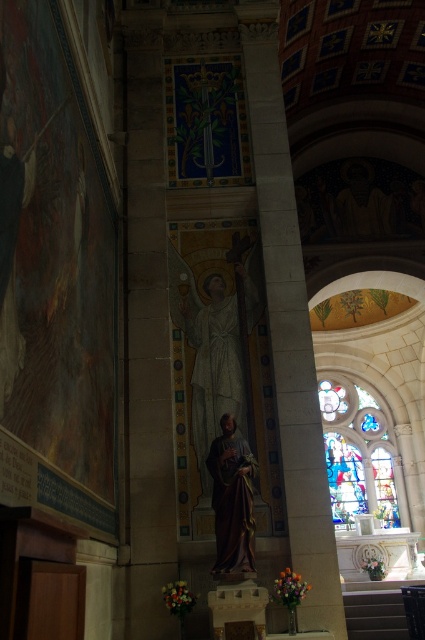
You are standing in the center of the church. There is a golden polished statue at center and a stained glass window at center. Which object is closer to you?

Both the stained glass window at center and the golden polished statue at center are at the center, so they are equidistant from you.

You are an architect inspecting the church. You notice the matte white statue at center and the stained glass window at center. Which object is placed higher in the scene?

The matte white statue at center is positioned over the stained glass window at center, so it is higher in the scene.